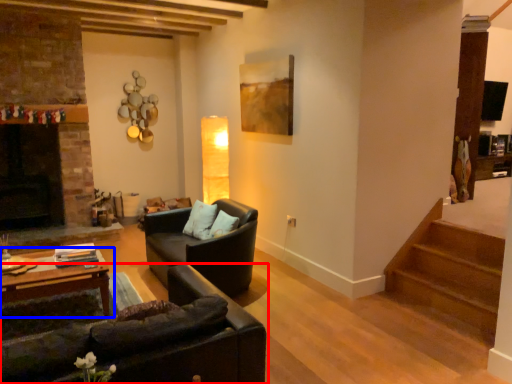
Question: Which point is closer to the camera, studio couch (highlighted by a red box) or table (highlighted by a blue box)?

Choices:
 (A) studio couch
 (B) table

Answer: (A)